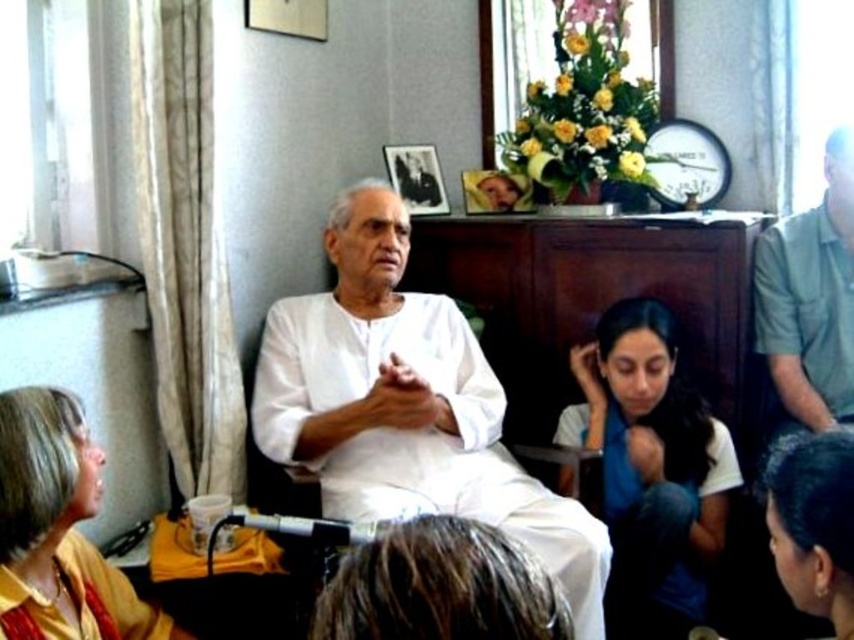
Question: Considering the relative positions of white cotton shirt at lower center and yellow fabric at lower left in the image provided, where is white cotton shirt at lower center located with respect to yellow fabric at lower left?

Choices:
 (A) above
 (B) below

Answer: (A)

Question: Among these points, which one is nearest to the camera?

Choices:
 (A) (771, 296)
 (B) (60, 465)
 (C) (841, 609)

Answer: (C)

Question: Does white cotton shirt at lower center have a lesser width compared to yellow fabric at lower left?

Choices:
 (A) yes
 (B) no

Answer: (B)

Question: Which object appears farthest from the camera in this image?

Choices:
 (A) brown hair at center
 (B) black hair at center
 (C) white cotton shirt at lower center
 (D) green fabric shirt at right

Answer: (D)

Question: Does white cotton kurta at center have a lesser width compared to white cotton shirt at lower center?

Choices:
 (A) no
 (B) yes

Answer: (A)

Question: Which point is farther to the camera?

Choices:
 (A) white cotton kurta at center
 (B) green fabric shirt at right
 (C) black hair at center

Answer: (B)